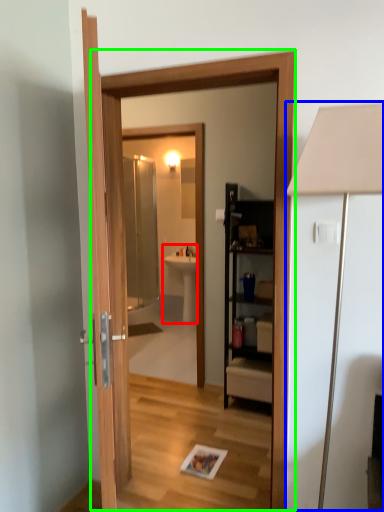
Question: Based on their relative distances, which object is farther from sink (highlighted by a red box)? Choose from table lamp (highlighted by a blue box) and screen door (highlighted by a green box).

Choices:
 (A) table lamp
 (B) screen door

Answer: (A)